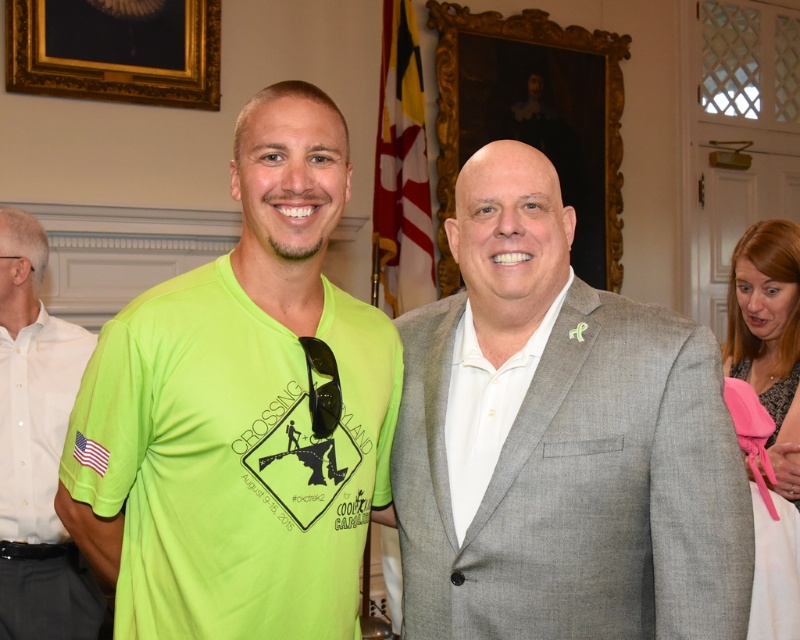
Consider the image. Does gray suit at center appear on the right side of neon green t-shirt at center?

Correct, you'll find gray suit at center to the right of neon green t-shirt at center.

Is gray suit at center to the left of neon green t-shirt at center from the viewer's perspective?

No, gray suit at center is not to the left of neon green t-shirt at center.

Locate an element on the screen. gray suit at center is located at coordinates (560, 442).

Does gray suit at center have a lesser width compared to neon green fabric at left?

No, gray suit at center is not thinner than neon green fabric at left.

This screenshot has width=800, height=640. What do you see at coordinates (560, 442) in the screenshot? I see `gray suit at center` at bounding box center [560, 442].

Between point (636, 580) and point (20, 524), which one is positioned behind?

Positioned behind is point (20, 524).

Locate an element on the screen. The width and height of the screenshot is (800, 640). gray suit at center is located at coordinates (560, 442).

Does neon green fabric at left appear over white smooth shirt at center?

No.

Can you confirm if neon green fabric at left is wider than white smooth shirt at center?

Indeed, neon green fabric at left has a greater width compared to white smooth shirt at center.

Locate an element on the screen. neon green fabric at left is located at coordinates (36, 420).

Where is `neon green fabric at left`? Image resolution: width=800 pixels, height=640 pixels. neon green fabric at left is located at coordinates (36, 420).